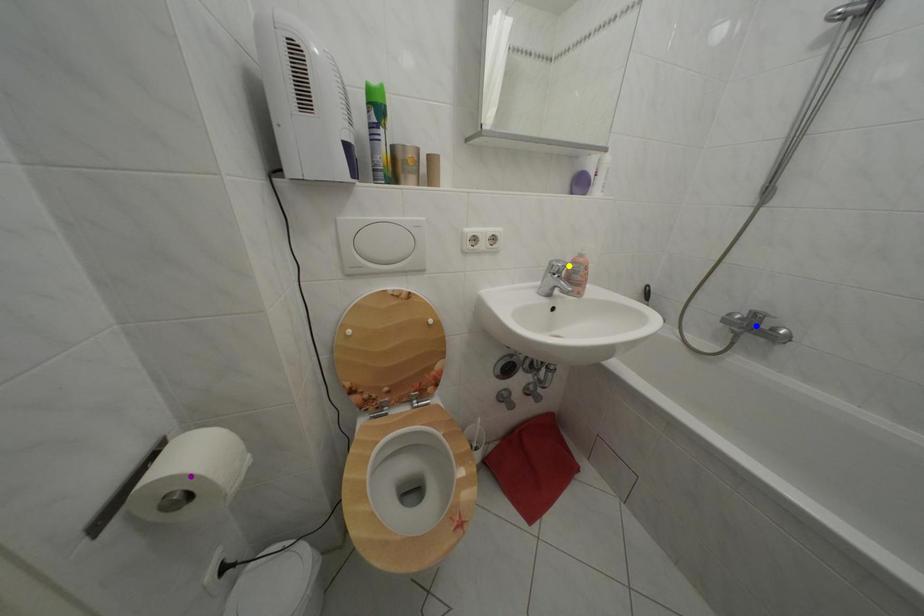
Order these from nearest to farthest:
A) blue point
B) yellow point
C) purple point

purple point
yellow point
blue point